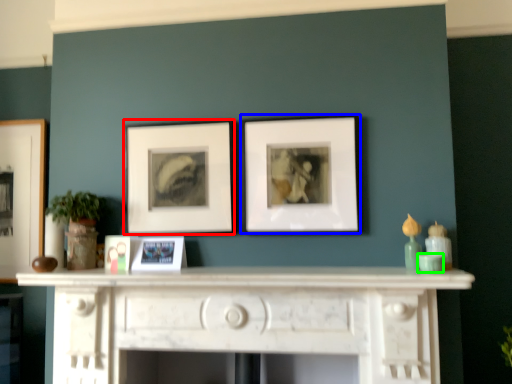
Question: Based on their relative distances, which object is farther from picture frame (highlighted by a red box)? Choose from picture frame (highlighted by a blue box) and teal (highlighted by a green box).

Choices:
 (A) picture frame
 (B) teal

Answer: (B)